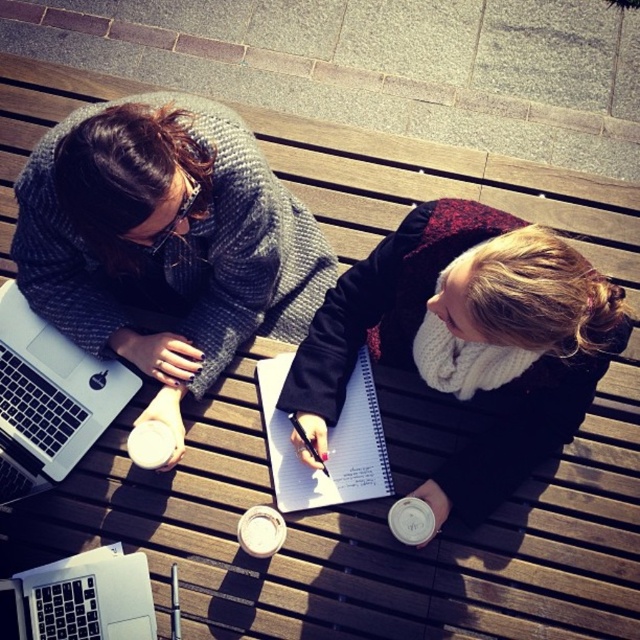
Question: Is matte black scarf at upper left thinner than silver metallic laptop at left?

Choices:
 (A) no
 (B) yes

Answer: (A)

Question: Which object is positioned closest to the black plastic pen at center?

Choices:
 (A) silver metallic laptop at left
 (B) silver metallic laptop at lower left
 (C) white spiral notebook at center
 (D) white knit scarf at upper right

Answer: (C)

Question: Does matte black scarf at upper left appear on the right side of black plastic pen at center?

Choices:
 (A) yes
 (B) no

Answer: (B)

Question: Which object is positioned closest to the silver metallic laptop at left?

Choices:
 (A) white spiral notebook at center
 (B) white knit scarf at upper right
 (C) black plastic pen at center

Answer: (A)

Question: Does silver metallic laptop at left have a larger size compared to black plastic pen at center?

Choices:
 (A) yes
 (B) no

Answer: (A)

Question: Among these points, which one is nearest to the camera?

Choices:
 (A) (19, 636)
 (B) (344, 273)
 (C) (296, 420)
 (D) (64, 465)

Answer: (A)